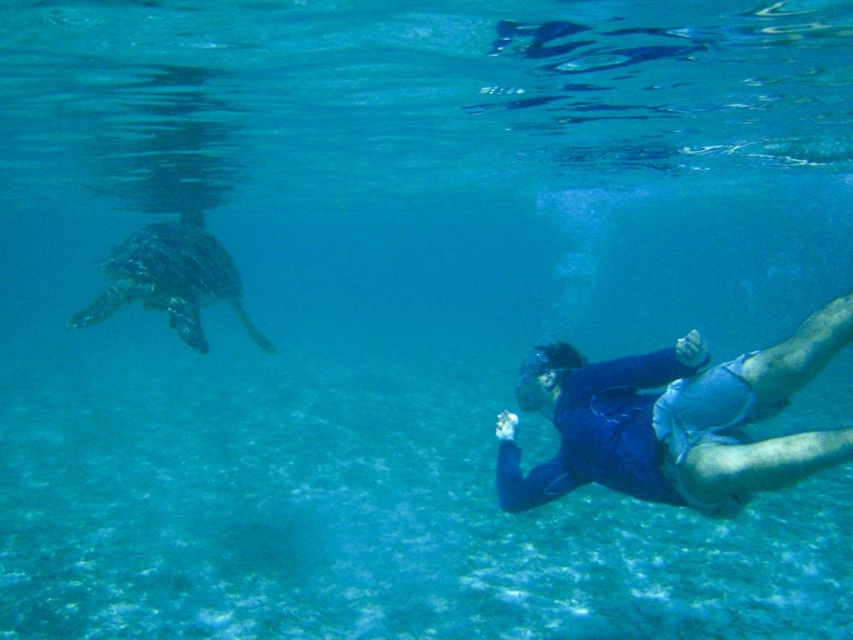
Question: Which point is closer to the camera taking this photo?

Choices:
 (A) (817, 328)
 (B) (196, 280)

Answer: (A)

Question: Does blue fabric diver at lower right appear on the left side of green textured turtle at left?

Choices:
 (A) yes
 (B) no

Answer: (B)

Question: Is blue fabric diver at lower right above green textured turtle at left?

Choices:
 (A) no
 (B) yes

Answer: (A)

Question: Does blue fabric diver at lower right have a smaller size compared to green textured turtle at left?

Choices:
 (A) no
 (B) yes

Answer: (B)

Question: Which point is closer to the camera?

Choices:
 (A) (791, 440)
 (B) (222, 300)

Answer: (A)

Question: Among these objects, which one is farthest from the camera?

Choices:
 (A) blue fabric diver at lower right
 (B) green textured turtle at left

Answer: (B)